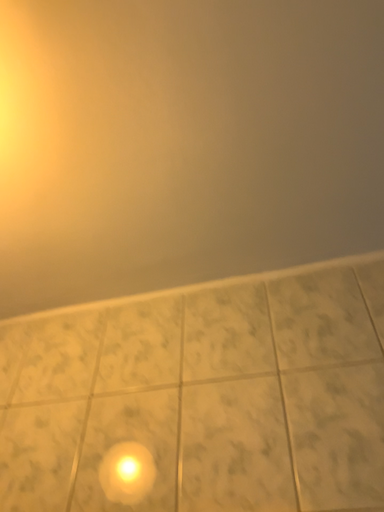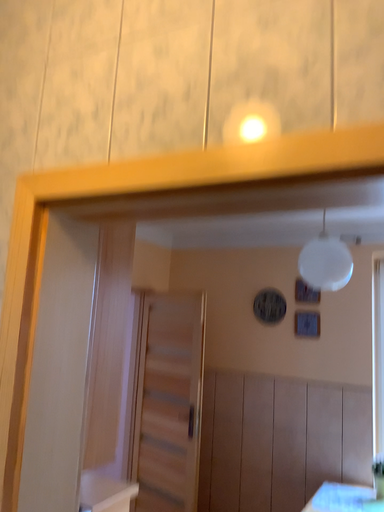
Question: Which way did the camera rotate in the video?

Choices:
 (A) rotated upward
 (B) rotated downward

Answer: (B)